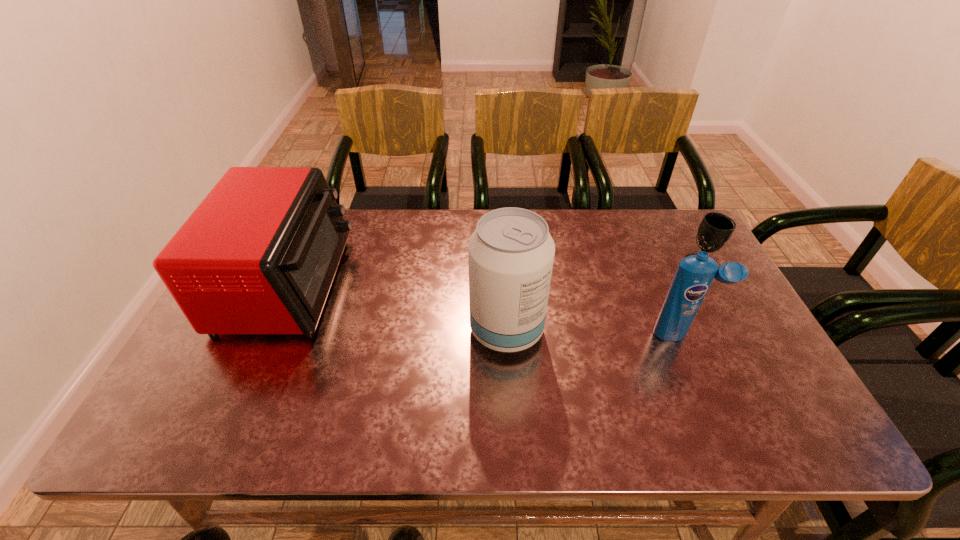
Identify the location of toaster oven positioned at the far edge. (259, 254).

Locate an element on the screen. The height and width of the screenshot is (540, 960). chalice at the far edge is located at coordinates (715, 230).

Image resolution: width=960 pixels, height=540 pixels. What are the coordinates of `object situated at the left edge` in the screenshot? It's located at (259, 254).

Find the location of a particular element. shampoo that is at the right edge is located at coordinates (694, 275).

Image resolution: width=960 pixels, height=540 pixels. What are the coordinates of `chalice that is at the right edge` in the screenshot? It's located at (715, 230).

Find the location of a particular element. Image resolution: width=960 pixels, height=540 pixels. object that is at the far left corner is located at coordinates (259, 254).

The width and height of the screenshot is (960, 540). Find the location of `object at the far right corner`. object at the far right corner is located at coordinates (715, 230).

Where is `vacant space at the far edge`? The height and width of the screenshot is (540, 960). vacant space at the far edge is located at coordinates (415, 217).

You are a GUI agent. You are given a task and a screenshot of the screen. Output one action in this format:
    pyautogui.click(x=<x>, y=<y>)
    Task: Click on the vacant space at the near edge of the desktop
    
    Given the screenshot: What is the action you would take?
    pyautogui.click(x=313, y=433)

Locate an element on the screen. This screenshot has width=960, height=540. free space at the left edge of the desktop is located at coordinates (195, 396).